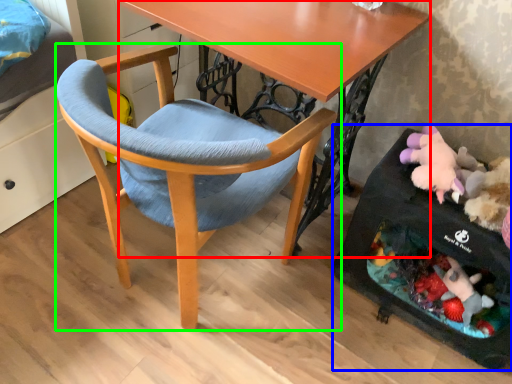
Question: Based on their relative distances, which object is nearer to desk (highlighted by a red box)? Choose from baby carriage (highlighted by a blue box) and chair (highlighted by a green box).

Choices:
 (A) baby carriage
 (B) chair

Answer: (B)